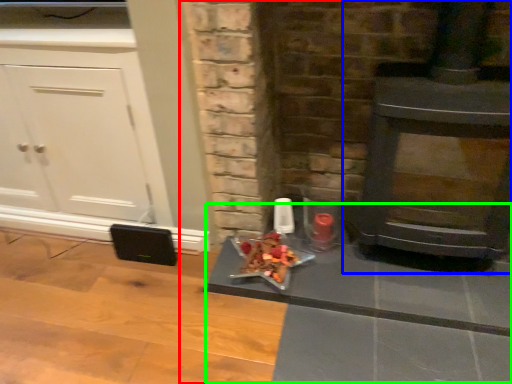
Question: Which object is the farthest from fireplace (highlighted by a red box)? Choose among these: wood burning stove (highlighted by a blue box) or table (highlighted by a green box).

Choices:
 (A) wood burning stove
 (B) table

Answer: (A)